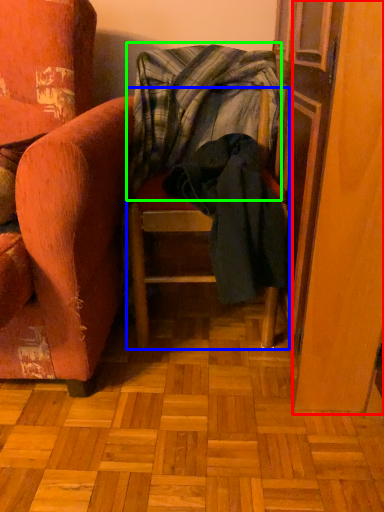
Question: Which object is positioned farthest from screen door (highlighted by a red box)? Select from furniture (highlighted by a blue box) and blanket (highlighted by a green box).

Choices:
 (A) furniture
 (B) blanket

Answer: (B)